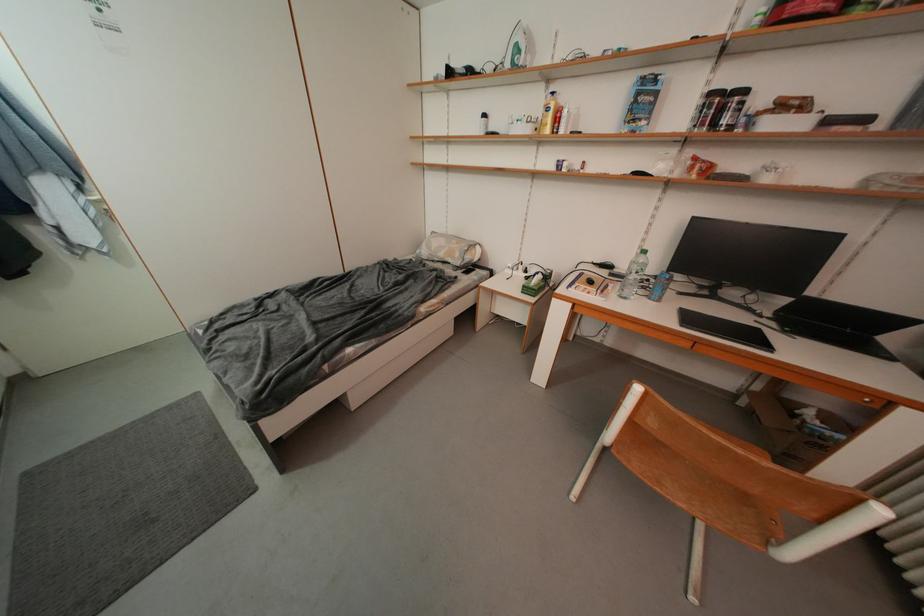
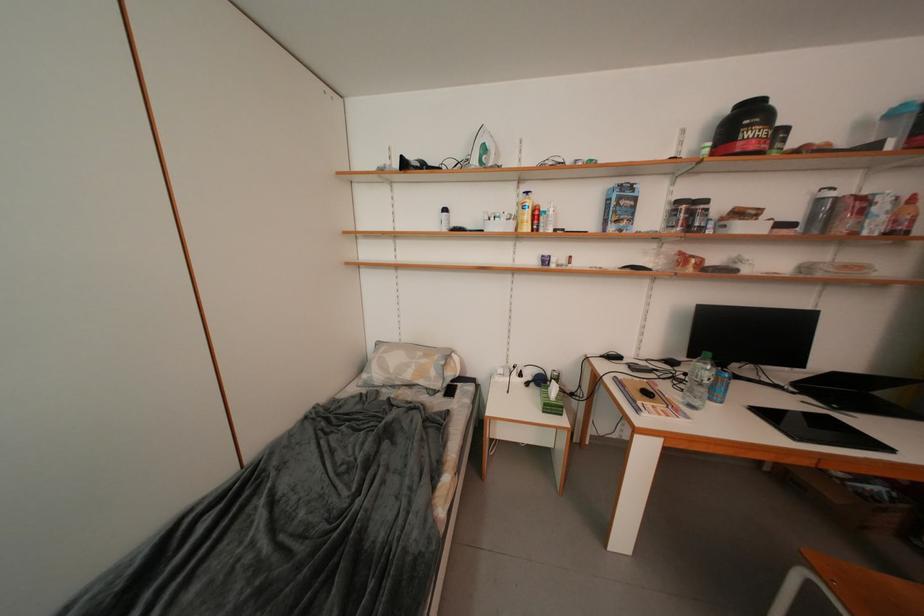
Question: How did the camera likely rotate?

Choices:
 (A) Left
 (B) Right
 (C) Up
 (D) Down

Answer: (B)